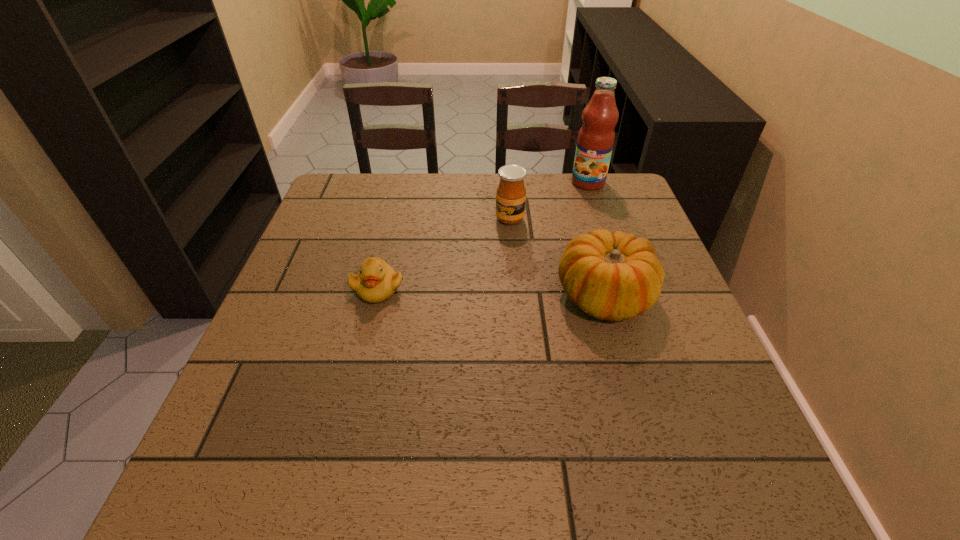
Where is `vacant space located 0.280m on the front label of the farthest object`? vacant space located 0.280m on the front label of the farthest object is located at coordinates (549, 242).

Identify the location of blank space located on the front label of the farthest object. (564, 220).

Find the location of a particular element. free spot located on the front-facing side of the third object from right to left is located at coordinates (470, 298).

Find the location of `vacant space situated on the front-facing side of the third object from right to left`. vacant space situated on the front-facing side of the third object from right to left is located at coordinates (458, 323).

Where is `free space located 0.150m on the front-facing side of the third object from right to left`? The image size is (960, 540). free space located 0.150m on the front-facing side of the third object from right to left is located at coordinates (489, 262).

Find the location of `fruit juice that is at the far edge`. fruit juice that is at the far edge is located at coordinates (596, 137).

Locate an element on the screen. The height and width of the screenshot is (540, 960). honey that is positioned at the far edge is located at coordinates (511, 193).

Identify the location of object at the left edge. (376, 282).

In order to click on gourd present at the right edge in this screenshot , I will do `click(613, 276)`.

Where is `fruit juice that is at the right edge`? The image size is (960, 540). fruit juice that is at the right edge is located at coordinates tap(596, 137).